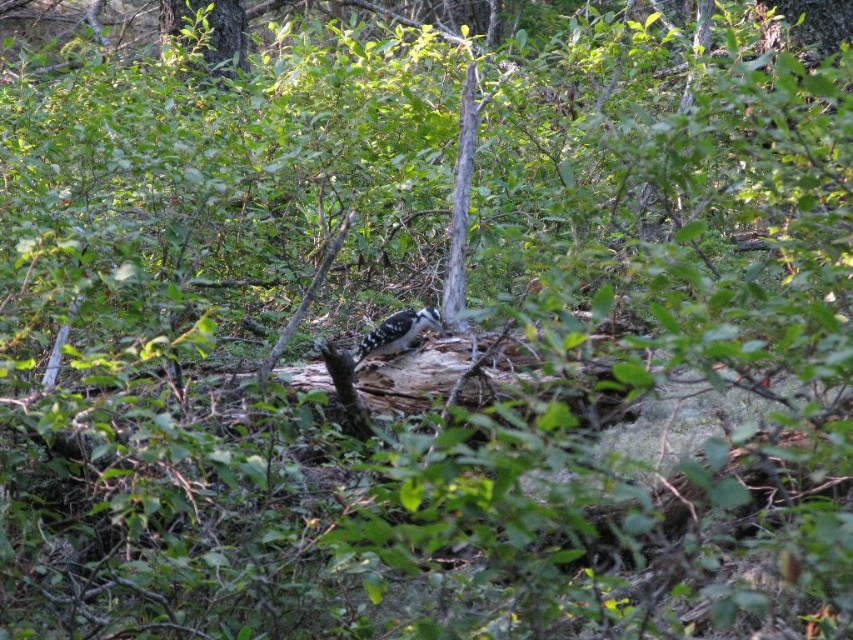
You are a hiker in the forest and want to take a photo of the speckled brown woodpecker at center. To avoid blocking the view, you need to position yourself so that the green leafy tree at upper center is not in front of the woodpecker. Which side of the woodpecker should you stand on?

The green leafy tree at upper center is positioned on the left side of the speckled brown woodpecker at center. To avoid blocking the view, you should stand on the right side of the woodpecker so that the tree is not in front of it.